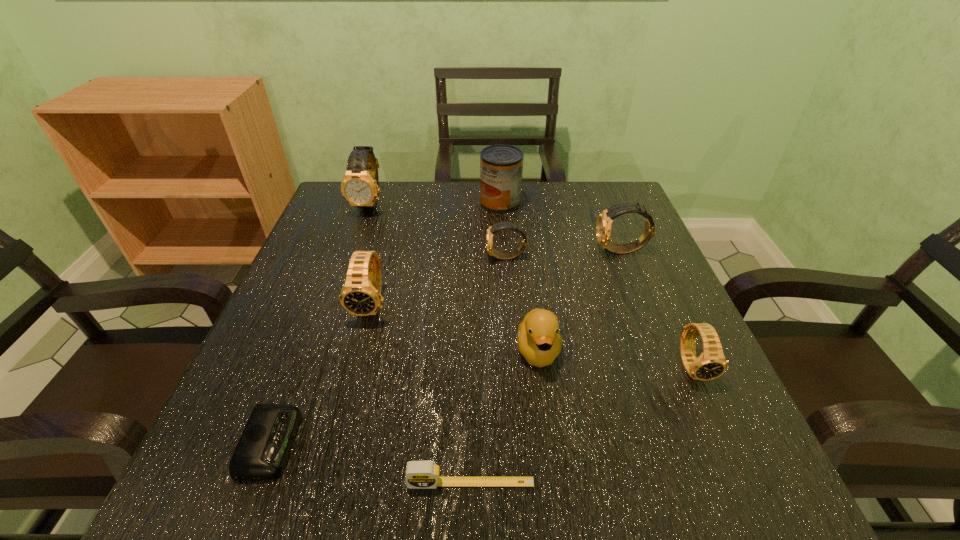
Locate an element on the screen. The width and height of the screenshot is (960, 540). the biggest gold watch is located at coordinates (360, 187).

The width and height of the screenshot is (960, 540). I want to click on the leftmost gold watch, so 360,187.

Find the location of `can`. can is located at coordinates (501, 166).

Image resolution: width=960 pixels, height=540 pixels. What are the coordinates of `the second smallest gold watch` in the screenshot? It's located at (604, 222).

The image size is (960, 540). Identify the location of the fifth nearest object. (361, 294).

Identify the location of the farther black watch. (361, 294).

Where is `duckling`? The image size is (960, 540). duckling is located at coordinates (539, 339).

In order to click on the smallest gold watch in this screenshot , I will do `click(496, 254)`.

Where is `the second gold watch from left to right`? the second gold watch from left to right is located at coordinates (496, 254).

The width and height of the screenshot is (960, 540). Identify the location of the smaller black watch. (711, 364).